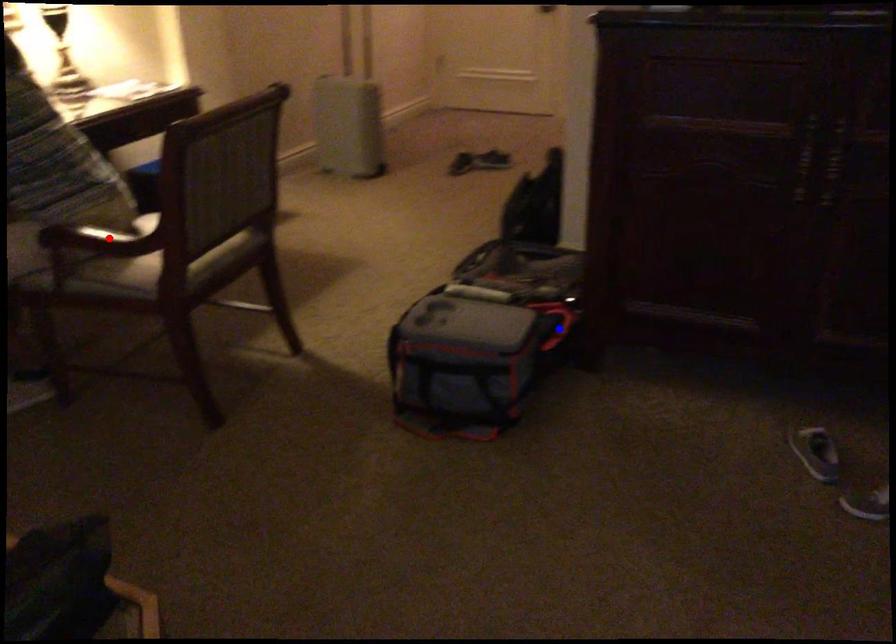
Question: Which of the two points in the image is closer to the camera?

Choices:
 (A) Blue point is closer.
 (B) Red point is closer.

Answer: (B)